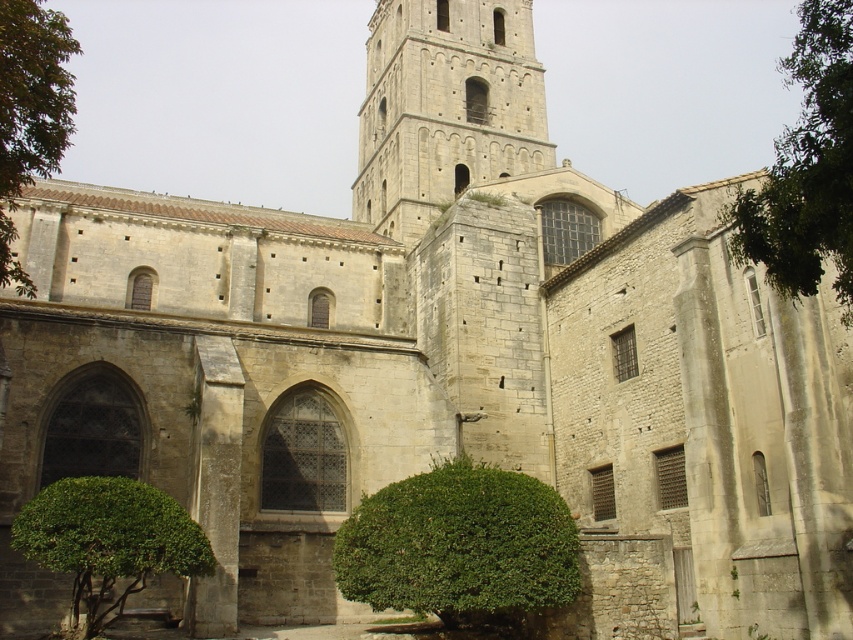
You are an architect examining the historic stone building. You notice the green leafy tree at upper right and the green leafy bush at left. Which of these two plants is taller?

The green leafy tree at upper right is taller than the green leafy bush at left.

You are standing in front of the historic stone building and notice the gray stone tower at center and the green leafy bush at center. Which object is located to the left of the other?

The gray stone tower at center is positioned on the left side of green leafy bush at center.